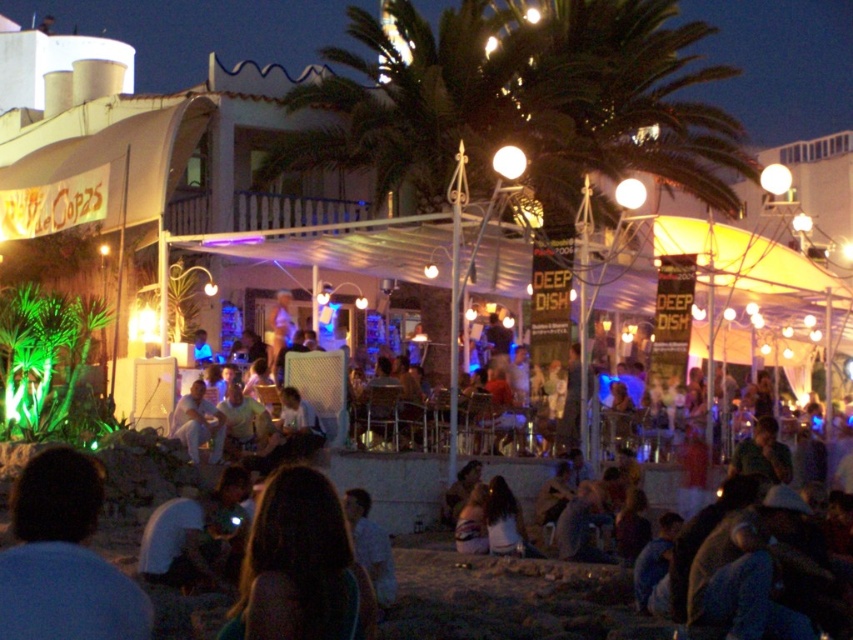
You are standing at the entrance of the beachside restaurant and want to find the blue fabric shirt at lower left. According to the coordinates provided, in which direction should you look to locate it?

The blue fabric shirt at lower left is located at point coordinates, so you should look to the lower left direction to find it.

You are a photographer taking a picture of the beachside restaurant scene. You notice the blue fabric shirt at lower left and the dark brown hair at center. Which object would appear larger in your photo?

The blue fabric shirt at lower left would appear larger in the photo because it is bigger than the dark brown hair at center according to the description.